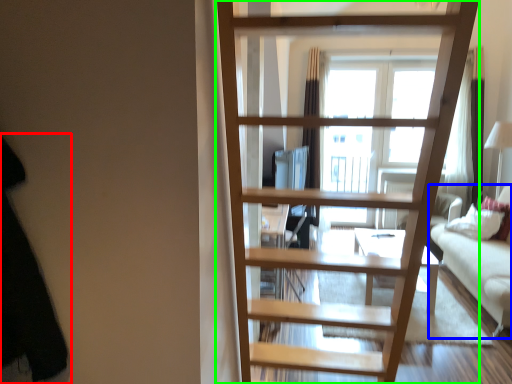
Question: Which is farther away from dark (highlighted by a red box)? studio couch (highlighted by a blue box) or ladder (highlighted by a green box)?

Choices:
 (A) studio couch
 (B) ladder

Answer: (A)